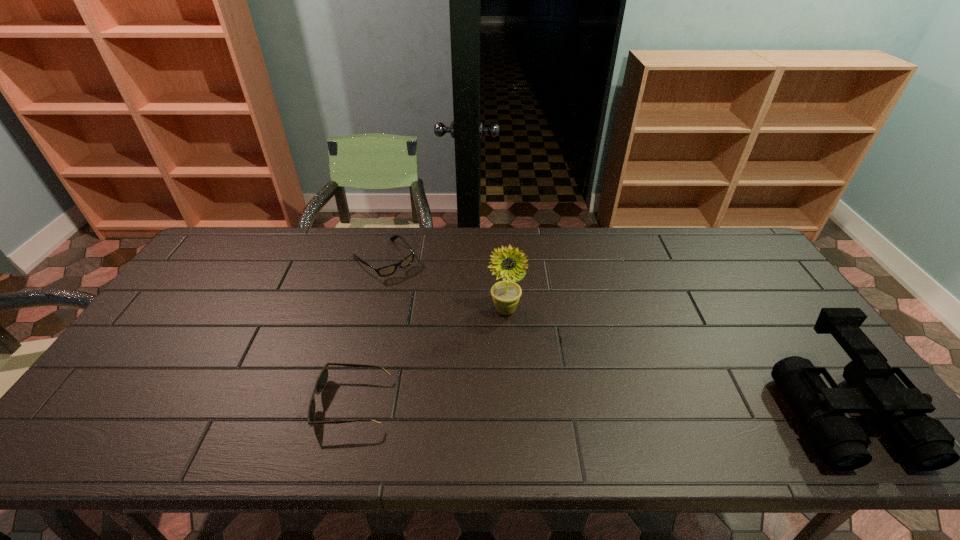
Identify the location of vacant space on the desktop that is between the sunglasses and the third shortest object and is positioned on the front-facing side of the farthest object. This screenshot has height=540, width=960. (537, 406).

Find the location of `vacant space on the desktop that is between the sunglasses and the rightmost object and is positioned on the face of the second farthest object`. vacant space on the desktop that is between the sunglasses and the rightmost object and is positioned on the face of the second farthest object is located at coordinates (584, 406).